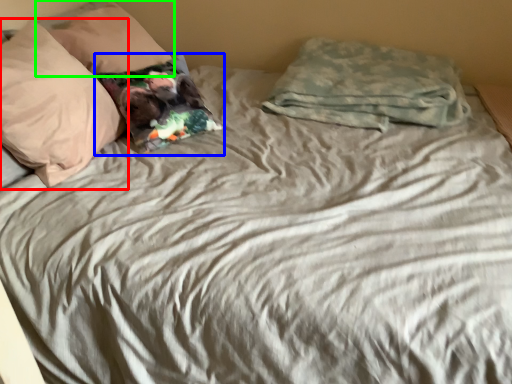
Question: Which is farther away from pillow (highlighted by a red box)? pillow (highlighted by a blue box) or pillow (highlighted by a green box)?

Choices:
 (A) pillow
 (B) pillow

Answer: (B)